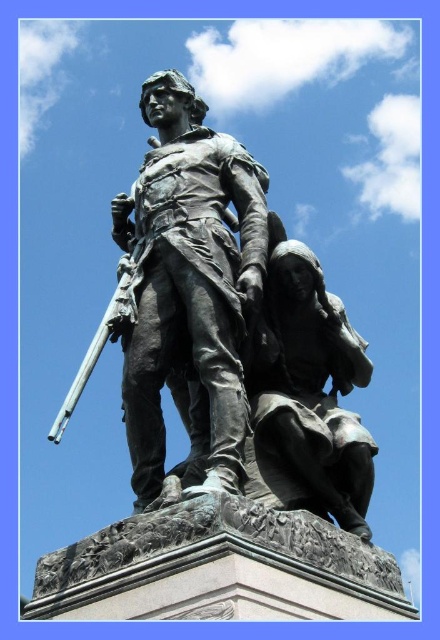
You are an art student analyzing the composition of the scene. Based on the positioning of the bronze statue at center and bronze statue at lower right, which one appears higher in the image?

The bronze statue at center appears higher in the image than the bronze statue at lower right because it is positioned above it.

You are an art curator planning to display both the bronze statue at center and the bronze statue at lower right in a gallery. Given their sizes, which statue should be placed in the larger designated exhibition space?

The bronze statue at center is bigger than the bronze statue at lower right, so it should be placed in the larger designated exhibition space.

You are an art conservator tasked with placing a protective barrier around the bronze statue at center. The barrier must be placed at a specific coordinate to ensure it is centered around the statue. What are the coordinates where you should place the barrier?

The bronze statue at center is located at coordinates point (x=189, y=282), so you should place the barrier at point (x=189, y=282) to ensure it is centered around the statue.